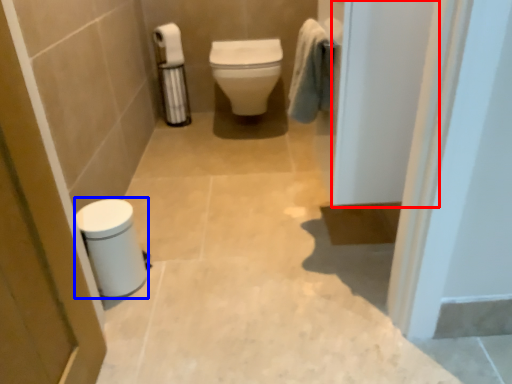
Question: Which object appears farthest to the camera in this image, screen door (highlighted by a red box) or porcelain (highlighted by a blue box)?

Choices:
 (A) screen door
 (B) porcelain

Answer: (B)